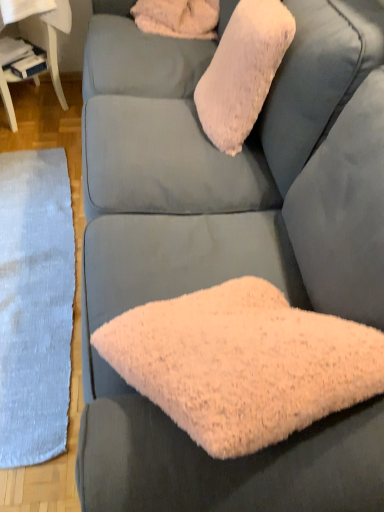
Question: From the image's perspective, relative to white fluffy pillow at upper center, is white glossy table at lower left above or below?

Choices:
 (A) above
 (B) below

Answer: (B)

Question: Considering the positions of white glossy table at lower left and white fluffy pillow at upper center in the image, is white glossy table at lower left bigger or smaller than white fluffy pillow at upper center?

Choices:
 (A) big
 (B) small

Answer: (A)

Question: Which is farther from the fluffy pink pillow at upper center?

Choices:
 (A) white glossy table at lower left
 (B) white fluffy pillow at upper center
 (C) gray woolen mat at left

Answer: (A)

Question: Estimate the real-world distances between objects in this image. Which object is closer to the fluffy pink pillow at upper center?

Choices:
 (A) gray woolen mat at left
 (B) white glossy table at lower left
 (C) white fluffy pillow at upper center

Answer: (C)